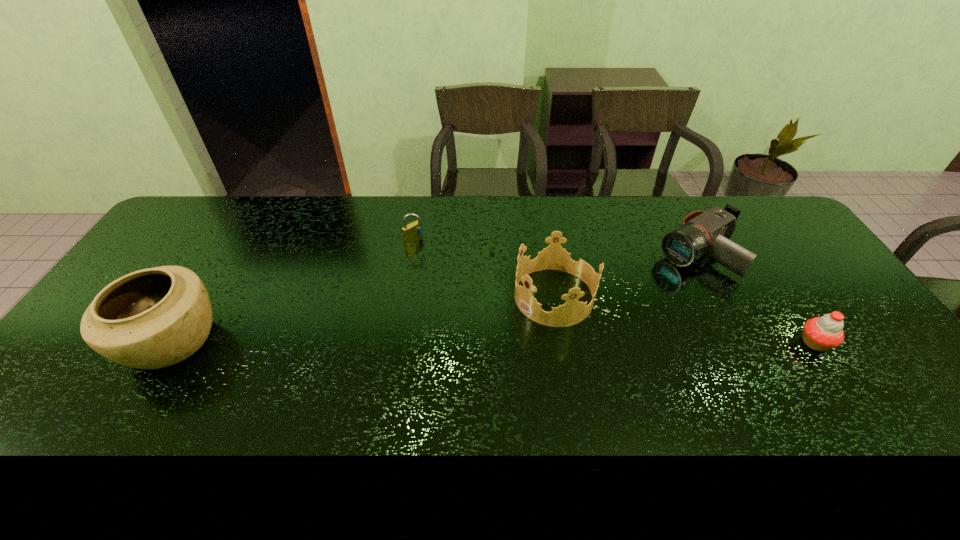
At what (x,y) coordinates should I click in order to perform the action: click on vacant space located 0.220m on the front-facing side of the tiara. Please return your answer as a coordinate pair (x, y). The width and height of the screenshot is (960, 540). Looking at the image, I should click on (462, 354).

Where is `vacant area situated 0.280m on the front-facing side of the tiara`? Image resolution: width=960 pixels, height=540 pixels. vacant area situated 0.280m on the front-facing side of the tiara is located at coordinates 443,366.

Locate an element on the screen. Image resolution: width=960 pixels, height=540 pixels. vacant space located on the lens of the camcorder is located at coordinates (610, 308).

Where is `vacant space located 0.360m on the lens of the camcorder`? This screenshot has height=540, width=960. vacant space located 0.360m on the lens of the camcorder is located at coordinates (589, 321).

In order to click on vacant space located on the lens of the camcorder in this screenshot , I will do `click(589, 321)`.

You are a GUI agent. You are given a task and a screenshot of the screen. Output one action in this format:
    pyautogui.click(x=<x>, y=<y>)
    Task: Click on the vacant region located on the side with the combination dials of the second object from left to right
    
    Given the screenshot: What is the action you would take?
    pyautogui.click(x=478, y=290)

The height and width of the screenshot is (540, 960). In order to click on free space located on the side with the combination dials of the second object from left to right in this screenshot , I will do `click(494, 303)`.

Where is `vacant area located on the side with the combination dials of the second object from left to right`? Image resolution: width=960 pixels, height=540 pixels. vacant area located on the side with the combination dials of the second object from left to right is located at coordinates (492, 301).

Locate an element on the screen. camcorder situated at the far edge is located at coordinates (701, 232).

The height and width of the screenshot is (540, 960). Identify the location of padlock that is at the far edge. (413, 231).